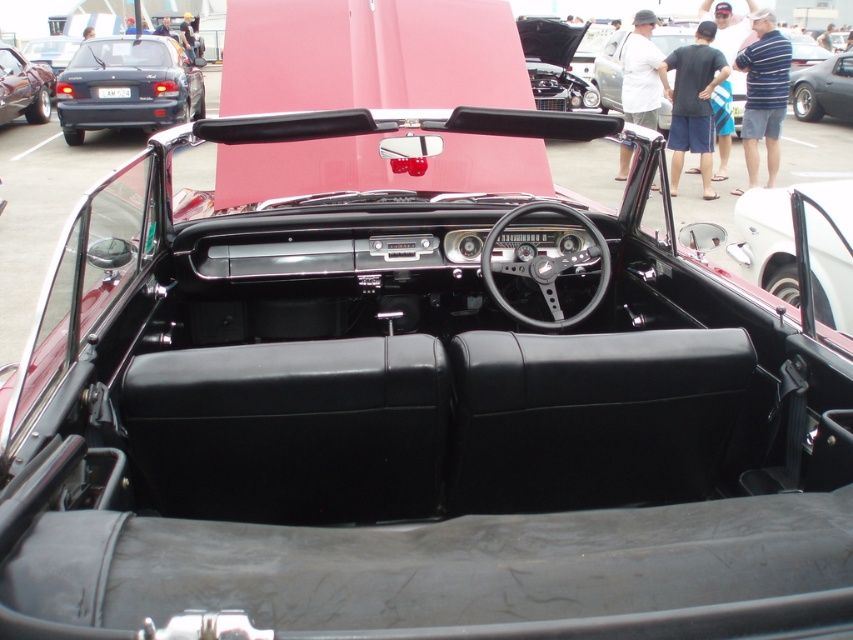
Question: Which point appears farthest from the camera in this image?

Choices:
 (A) (737, 212)
 (B) (140, 61)

Answer: (B)

Question: Which point appears farthest from the camera in this image?

Choices:
 (A) (819, 97)
 (B) (782, 244)
 (C) (56, 72)

Answer: (C)

Question: Can you confirm if shiny white door at right is smaller than shiny black car at upper right?

Choices:
 (A) no
 (B) yes

Answer: (B)

Question: Does shiny black convertible at left come in front of matte black convertible at center?

Choices:
 (A) yes
 (B) no

Answer: (A)

Question: Which object is closer to the camera taking this photo?

Choices:
 (A) shiny black convertible at left
 (B) matte black convertible at center
 (C) shiny white door at right

Answer: (C)

Question: Does matte black sedan at upper left appear on the right side of shiny black car at upper right?

Choices:
 (A) yes
 (B) no

Answer: (B)